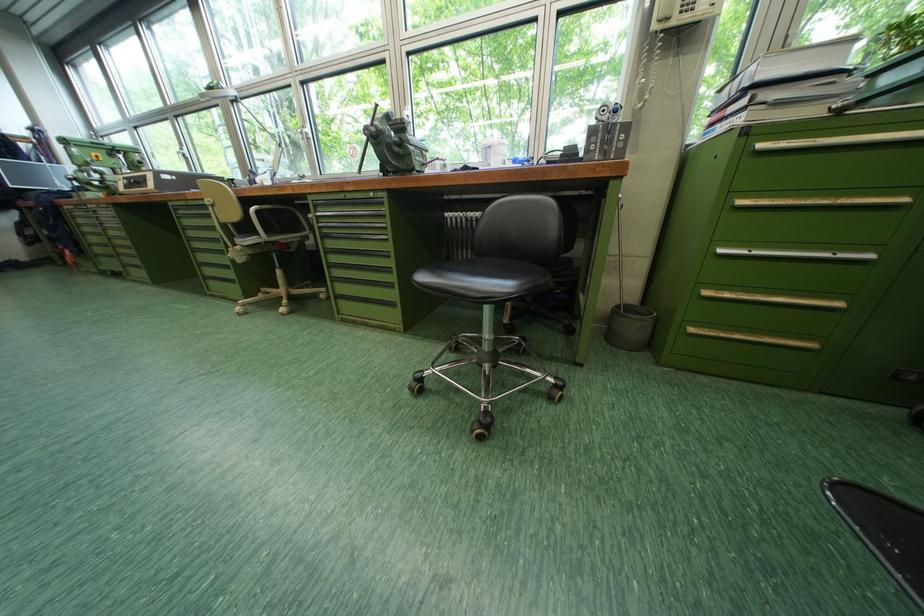
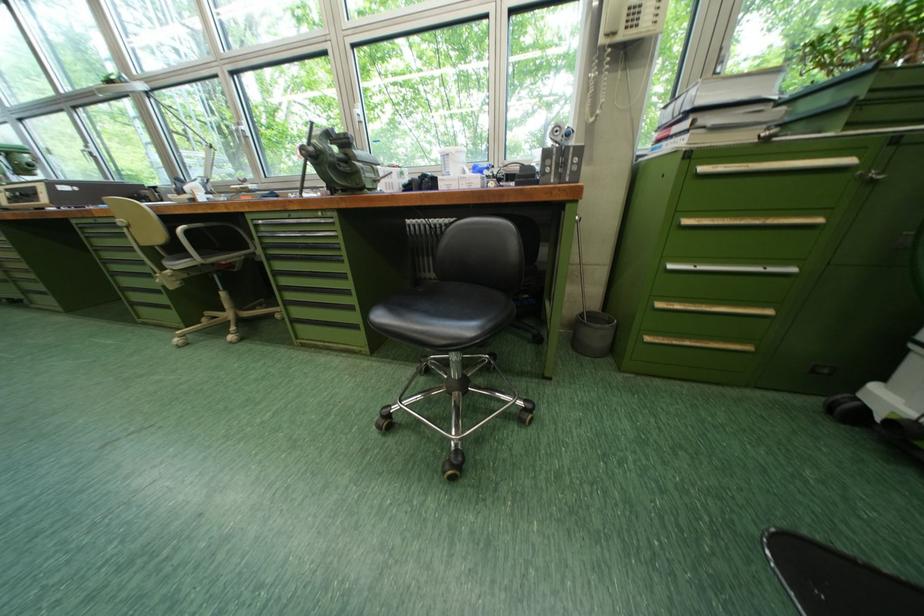
Locate, in the second image, the point that corresponds to pixel 701 331 in the first image.

(659, 341)